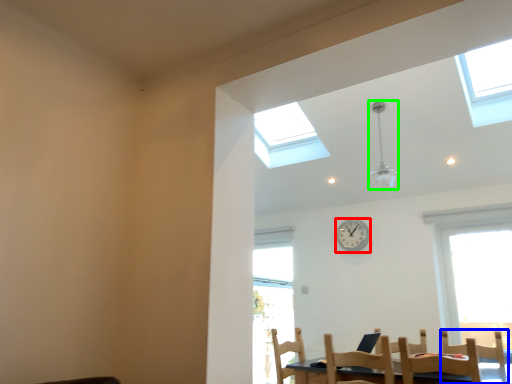
Question: Which object is positioned closest to clock (highlighted by a red box)? Select from chair (highlighted by a blue box) and light fixture (highlighted by a green box).

Choices:
 (A) chair
 (B) light fixture

Answer: (B)